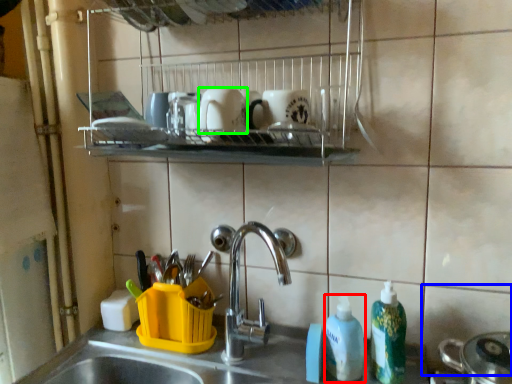
Question: Which object is the closest to the cleaning product (highlighted by a red box)? Choose among these: tile (highlighted by a blue box) or mug (highlighted by a green box).

Choices:
 (A) tile
 (B) mug

Answer: (A)